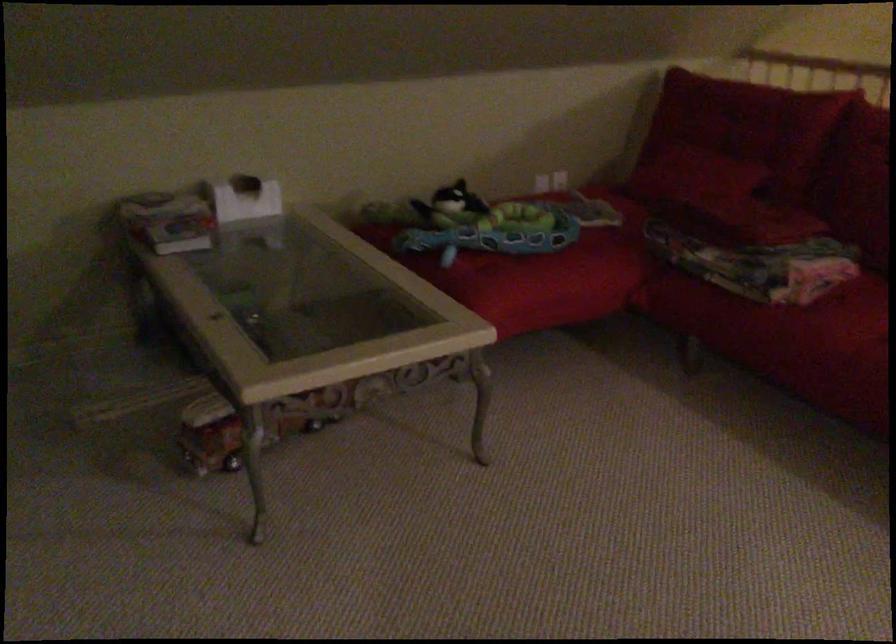
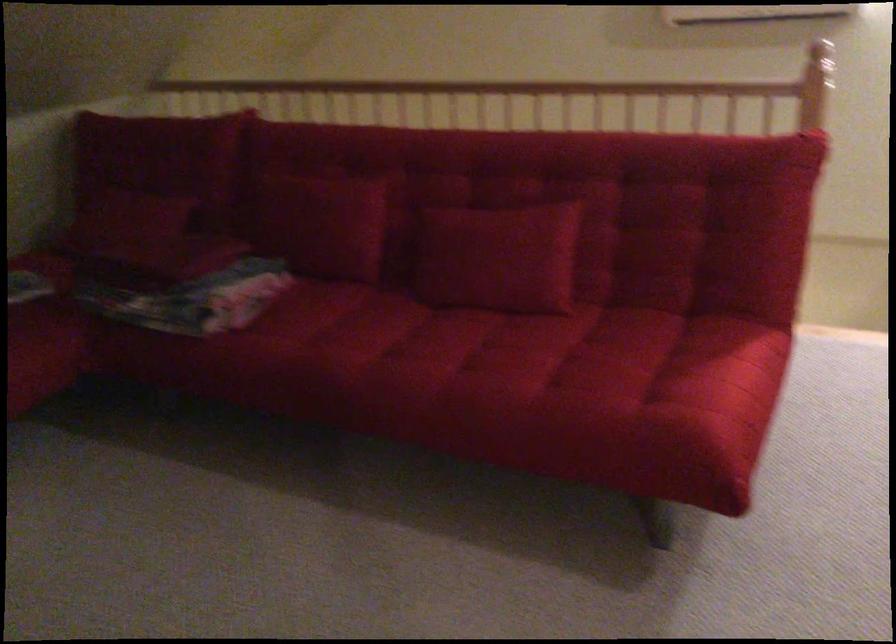
Question: The camera is either moving clockwise (left) or counter-clockwise (right) around the object. The first image is from the beginning of the video and the second image is from the end. Is the camera moving left or right when shooting the video?

Choices:
 (A) Left
 (B) Right

Answer: (A)